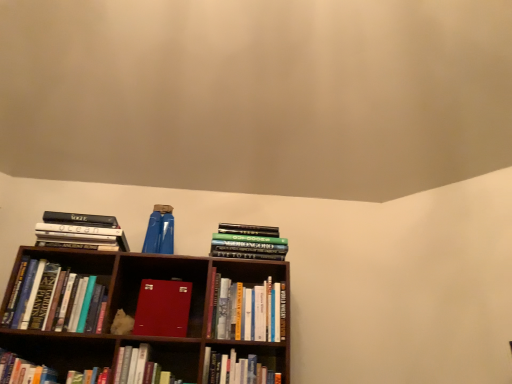
The height and width of the screenshot is (384, 512). Describe the element at coordinates (81, 231) in the screenshot. I see `hardcover books at left, marked as the third book in a left-to-right arrangement` at that location.

I want to click on hardcover book at center, the second book from the right, so click(251, 311).

Locate an element on the screen. green matte book at center, which ranks as the first book in right-to-left order is located at coordinates (248, 242).

In order to face hardcover book at lower center, placed as the 5th book when sorted from left to right, should I rotate leftwards or rightwards?

You should look left and rotate roughly 12.557 degrees.

This screenshot has width=512, height=384. What do you see at coordinates (140, 368) in the screenshot?
I see `hardcover book at lower center, placed as the 5th book when sorted from left to right` at bounding box center [140, 368].

Where is `matte red book at center, which appears as the fourth book when viewed from the left`? The image size is (512, 384). matte red book at center, which appears as the fourth book when viewed from the left is located at coordinates (163, 308).

What do you see at coordinates (236, 369) in the screenshot? The width and height of the screenshot is (512, 384). I see `hardcover book at lower center, which is the sixth book from left to right` at bounding box center [236, 369].

In order to face hardcover books at left, which appears as the 1th book when viewed from the left, should I rotate leftwards or rightwards?

Turn left by 23.901 degrees to look at hardcover books at left, which appears as the 1th book when viewed from the left.

Where is `hardcover books at left, marked as the third book in a left-to-right arrangement`? This screenshot has height=384, width=512. hardcover books at left, marked as the third book in a left-to-right arrangement is located at coordinates (81, 231).

From a real-world perspective, is matte red book at center, marked as the fifth book in a right-to-left arrangement, on hardcover books at left, marked as the third book in a left-to-right arrangement?

No.

Considering the points (147, 294) and (89, 244), which point is behind, point (147, 294) or point (89, 244)?

The point (89, 244) is farther.

Is hardcover books at left, marked as the third book in a left-to-right arrangement, behind hardcover books at left, which appears as the 1th book when viewed from the left?

Yes, it is behind hardcover books at left, which appears as the 1th book when viewed from the left.

Considering the relative sizes of hardcover books at left, arranged as the 6th book when viewed from the right, and hardcover books at left, which appears as the 1th book when viewed from the left, in the image provided, is hardcover books at left, arranged as the 6th book when viewed from the right, taller than hardcover books at left, which appears as the 1th book when viewed from the left,?

No.

Is hardcover books at left, arranged as the 6th book when viewed from the right, next to hardcover books at left, which appears as the 1th book when viewed from the left?

No, hardcover books at left, arranged as the 6th book when viewed from the right, is not touching hardcover books at left, which appears as the 1th book when viewed from the left.

In the image, is hardcover books at left, marked as the third book in a left-to-right arrangement, on the left side or the right side of hardcover books at left, which is the 8th book from right to left?

In the image, hardcover books at left, marked as the third book in a left-to-right arrangement, appears on the right side of hardcover books at left, which is the 8th book from right to left.

How different are the orientations of hardcover books at left, marked as the third book in a left-to-right arrangement, and hardcover book at lower center, which is the sixth book from left to right, in degrees?

The angular difference between hardcover books at left, marked as the third book in a left-to-right arrangement, and hardcover book at lower center, which is the sixth book from left to right, is 2.77 degrees.

Are hardcover books at left, marked as the third book in a left-to-right arrangement, and hardcover book at lower center, which is the sixth book from left to right, located far from each other?

hardcover books at left, marked as the third book in a left-to-right arrangement, is actually quite close to hardcover book at lower center, which is the sixth book from left to right.

Which of these two, hardcover books at left, arranged as the 6th book when viewed from the right, or hardcover book at lower center, which is the sixth book from left to right, stands taller?

With more height is hardcover books at left, arranged as the 6th book when viewed from the right.

Is hardcover books at left, arranged as the 6th book when viewed from the right, thinner than hardcover book at lower center, the 3th book from the right?

In fact, hardcover books at left, arranged as the 6th book when viewed from the right, might be wider than hardcover book at lower center, the 3th book from the right.

Based on the photo, from the image's perspective, is hardcover book at lower center, placed as the 5th book when sorted from left to right, on hardcover books at left, which is the 8th book from right to left?

Actually, hardcover book at lower center, placed as the 5th book when sorted from left to right, appears below hardcover books at left, which is the 8th book from right to left, in the image.

Which point is more distant from viewer, (145, 360) or (77, 330)?

The point (145, 360) is farther.

Is hardcover book at lower center, placed as the 5th book when sorted from left to right, oriented towards hardcover books at left, which appears as the 1th book when viewed from the left?

No, hardcover book at lower center, placed as the 5th book when sorted from left to right, is not turned towards hardcover books at left, which appears as the 1th book when viewed from the left.

Between hardcover book at lower center, placed as the 5th book when sorted from left to right, and hardcover books at left, which is the 8th book from right to left, which one has larger width?

hardcover book at lower center, placed as the 5th book when sorted from left to right, is wider.

Is hardcover book at lower left, which ranks as the 2th book in left-to-right order, positioned behind matte red book at center, which appears as the fourth book when viewed from the left?

No, the depth of hardcover book at lower left, which ranks as the 2th book in left-to-right order, is less than that of matte red book at center, which appears as the fourth book when viewed from the left.

Between hardcover book at lower left, which ranks as the 2th book in left-to-right order, and matte red book at center, which appears as the fourth book when viewed from the left, which one has smaller size?

Smaller between the two is hardcover book at lower left, which ranks as the 2th book in left-to-right order.

Which is behind, point (158, 368) or point (181, 327)?

Positioned behind is point (158, 368).

In the scene shown: Does hardcover book at lower left, which is the 7th book in right-to-left order, turn towards hardcover book at lower center, arranged as the fourth book when viewed from the right?

No, hardcover book at lower left, which is the 7th book in right-to-left order, does not turn towards hardcover book at lower center, arranged as the fourth book when viewed from the right.

From the picture: Between hardcover book at lower left, which is the 7th book in right-to-left order, and hardcover book at lower center, arranged as the fourth book when viewed from the right, which one is positioned behind?

hardcover book at lower center, arranged as the fourth book when viewed from the right, is behind.

Can you confirm if hardcover book at lower left, which ranks as the 2th book in left-to-right order, is thinner than hardcover book at lower center, placed as the 5th book when sorted from left to right?

Correct, the width of hardcover book at lower left, which ranks as the 2th book in left-to-right order, is less than that of hardcover book at lower center, placed as the 5th book when sorted from left to right.

Choose the correct answer: Is hardcover book at lower left, which is the 7th book in right-to-left order, inside hardcover book at lower center, placed as the 5th book when sorted from left to right, or outside it?

hardcover book at lower left, which is the 7th book in right-to-left order, lies outside hardcover book at lower center, placed as the 5th book when sorted from left to right.

Considering the relative positions of hardcover books at left, which appears as the 1th book when viewed from the left, and hardcover book at center, the second book from the right, in the image provided, is hardcover books at left, which appears as the 1th book when viewed from the left, to the left of hardcover book at center, the second book from the right, from the viewer's perspective?

Yes.

Which object is wider, hardcover books at left, which is the 8th book from right to left, or hardcover book at center, the second book from the right?

With larger width is hardcover book at center, the second book from the right.

Is the depth of hardcover books at left, which is the 8th book from right to left, greater than that of hardcover book at center, the 7th book from the left?

No, hardcover books at left, which is the 8th book from right to left, is in front of hardcover book at center, the 7th book from the left.

From a real-world perspective, is hardcover books at left, which appears as the 1th book when viewed from the left, positioned under hardcover book at center, the second book from the right, based on gravity?

Yes, from a real-world perspective, hardcover books at left, which appears as the 1th book when viewed from the left, is below hardcover book at center, the second book from the right.

Find the location of `book that is the 4th object directly below the hardcover books at left, arranged as the 6th book when viewed from the right (from a real-world perspective)`. book that is the 4th object directly below the hardcover books at left, arranged as the 6th book when viewed from the right (from a real-world perspective) is located at coordinates (163, 308).

The width and height of the screenshot is (512, 384). In order to click on the 3rd book directly above the hardcover books at left, which appears as the 1th book when viewed from the left (from a real-world perspective) in this screenshot , I will do click(81, 231).

When comparing their distances from green matte book at center, which appears as the 8th book when viewed from the left, does matte red book at center, which appears as the fourth book when viewed from the left, or hardcover books at left, arranged as the 6th book when viewed from the right, seem further?

hardcover books at left, arranged as the 6th book when viewed from the right, is positioned further to the anchor green matte book at center, which appears as the 8th book when viewed from the left.

Looking at the image, which one is located closer to hardcover books at left, marked as the third book in a left-to-right arrangement, hardcover book at center, the second book from the right, or hardcover book at lower center, which is the sixth book from left to right?

hardcover book at center, the second book from the right, lies closer to hardcover books at left, marked as the third book in a left-to-right arrangement, than the other object.

When comparing their distances from green matte book at center, which appears as the 8th book when viewed from the left, does hardcover books at left, which appears as the 1th book when viewed from the left, or hardcover book at lower center, arranged as the fourth book when viewed from the right, seem closer?

hardcover book at lower center, arranged as the fourth book when viewed from the right, lies closer to green matte book at center, which appears as the 8th book when viewed from the left, than the other object.

Which object lies nearer to the anchor point hardcover book at lower center, the 3th book from the right, green matte book at center, which appears as the 8th book when viewed from the left, or hardcover book at center, the second book from the right?

Based on the image, hardcover book at center, the second book from the right, appears to be nearer to hardcover book at lower center, the 3th book from the right.

From the image, which object appears to be nearer to hardcover book at lower left, which ranks as the 2th book in left-to-right order, hardcover book at center, the 7th book from the left, or hardcover books at left, arranged as the 6th book when viewed from the right?

hardcover book at center, the 7th book from the left, is positioned closer to the anchor hardcover book at lower left, which ranks as the 2th book in left-to-right order.

Based on their spatial positions, is hardcover book at lower center, the 3th book from the right, or hardcover book at lower center, placed as the 5th book when sorted from left to right, closer to hardcover books at left, marked as the third book in a left-to-right arrangement?

The object closer to hardcover books at left, marked as the third book in a left-to-right arrangement, is hardcover book at lower center, placed as the 5th book when sorted from left to right.

Based on their spatial positions, is hardcover book at lower center, placed as the 5th book when sorted from left to right, or hardcover book at lower center, which is the sixth book from left to right, closer to matte red book at center, which appears as the fourth book when viewed from the left?

hardcover book at lower center, placed as the 5th book when sorted from left to right, is closer to matte red book at center, which appears as the fourth book when viewed from the left.

Looking at the image, which one is located further to hardcover book at lower center, placed as the 5th book when sorted from left to right, hardcover book at center, the second book from the right, or hardcover books at left, which appears as the 1th book when viewed from the left?

hardcover book at center, the second book from the right, is positioned further to the anchor hardcover book at lower center, placed as the 5th book when sorted from left to right.

Where is `book located between hardcover book at lower center, placed as the 5th book when sorted from left to right, and hardcover book at center, the second book from the right, in the left-right direction`? The width and height of the screenshot is (512, 384). book located between hardcover book at lower center, placed as the 5th book when sorted from left to right, and hardcover book at center, the second book from the right, in the left-right direction is located at coordinates [x=236, y=369].

The height and width of the screenshot is (384, 512). Find the location of `book between matte red book at center, which appears as the fourth book when viewed from the left, and hardcover book at lower center, which is the sixth book from left to right, from left to right`. book between matte red book at center, which appears as the fourth book when viewed from the left, and hardcover book at lower center, which is the sixth book from left to right, from left to right is located at coordinates (140, 368).